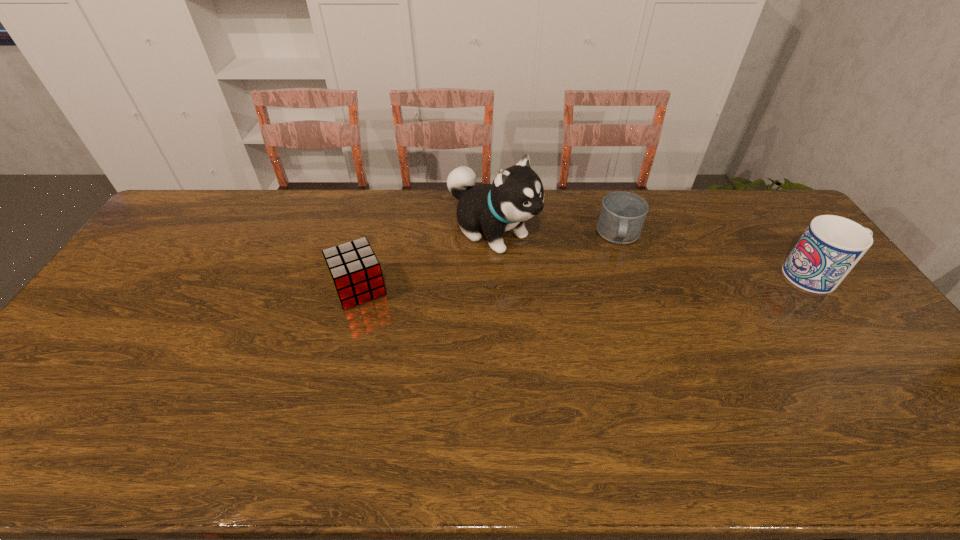
Where is `cube`? This screenshot has height=540, width=960. cube is located at coordinates click(x=354, y=269).

Locate an element on the screen. This screenshot has width=960, height=540. the rightmost object is located at coordinates (831, 246).

Locate an element on the screen. The image size is (960, 540). the nearer mug is located at coordinates (831, 246).

Where is `the shorter mug`? The height and width of the screenshot is (540, 960). the shorter mug is located at coordinates (622, 215).

The height and width of the screenshot is (540, 960). In order to click on the farther mug in this screenshot , I will do (x=622, y=215).

In order to click on puppy in this screenshot , I will do `click(516, 194)`.

Find the location of a particular element. The height and width of the screenshot is (540, 960). the tallest object is located at coordinates (516, 194).

Where is `vacant space located 0.210m on the left of the leftmost object`? The height and width of the screenshot is (540, 960). vacant space located 0.210m on the left of the leftmost object is located at coordinates (260, 288).

Where is `blank space located on the back of the right mug`? Image resolution: width=960 pixels, height=540 pixels. blank space located on the back of the right mug is located at coordinates (759, 195).

Where is `vacant area located 0.290m on the side of the shorter mug with the handle`? vacant area located 0.290m on the side of the shorter mug with the handle is located at coordinates (615, 323).